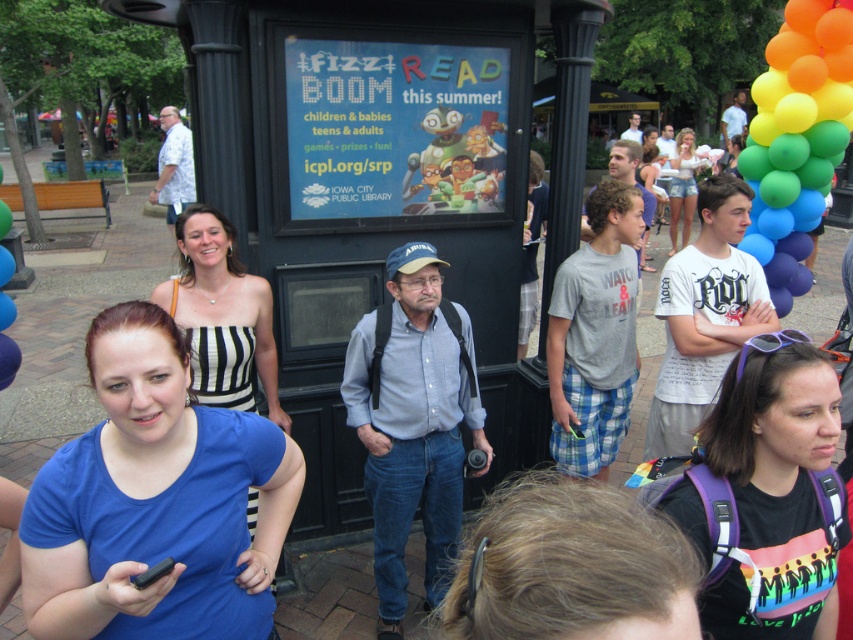
Who is shorter, rainbow balloons at right or denim shorts at upper right?

Standing shorter between the two is rainbow balloons at right.

Is point (747, 166) positioned in front of point (672, 182)?

Yes.

Is point (822, 168) closer to camera compared to point (682, 198)?

Yes, it is.

This screenshot has width=853, height=640. I want to click on rainbow balloons at right, so click(801, 106).

Is rainbow-patterned backpack at center smaller than denim shorts at upper right?

Indeed, rainbow-patterned backpack at center has a smaller size compared to denim shorts at upper right.

In the scene shown: Who is more forward, (793, 605) or (683, 136)?

Point (793, 605)

Find the location of a particular element. rainbow-patterned backpack at center is located at coordinates tap(775, 493).

Between point (804, 422) and point (798, 13), which one is positioned behind?

The point (798, 13) is behind.

Is point (782, 563) positioned after point (773, 193)?

No.

Identify the location of rainbow-patterned backpack at center. This screenshot has height=640, width=853. (775, 493).